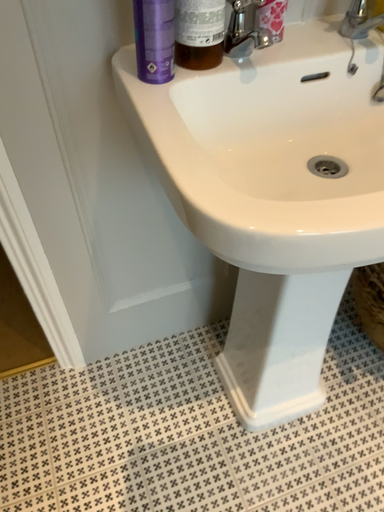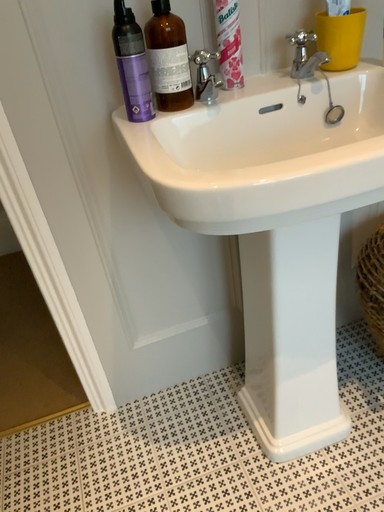
Question: Which way did the camera rotate in the video?

Choices:
 (A) rotated right
 (B) rotated left

Answer: (B)